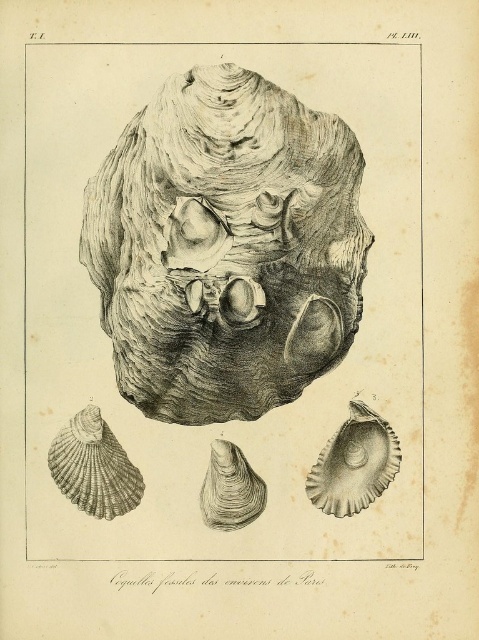
Question: Is gray textured shell at lower left smaller than smooth gray oyster at center?

Choices:
 (A) no
 (B) yes

Answer: (A)

Question: Among these points, which one is nearest to the camera?

Choices:
 (A) (242, 465)
 (B) (124, 486)

Answer: (B)

Question: Which point is closer to the camera taking this photo?

Choices:
 (A) (376, 486)
 (B) (63, 432)

Answer: (A)

Question: Does gray textured shell at lower left appear on the left side of smooth gray oyster at center?

Choices:
 (A) no
 (B) yes

Answer: (B)

Question: Which point appears closest to the camera in this image?

Choices:
 (A) (78, 461)
 (B) (319, 486)

Answer: (A)

Question: Is gray textured shell at lower left bigger than smooth gray oyster at center?

Choices:
 (A) no
 (B) yes

Answer: (B)